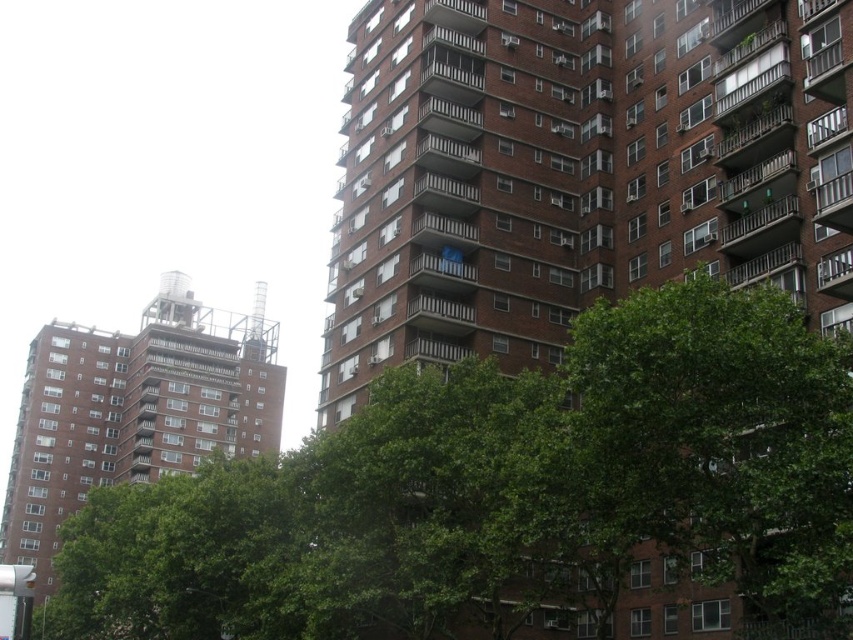
Does green leafy tree at lower left come behind green leafy tree at center?

Yes, green leafy tree at lower left is behind green leafy tree at center.

Is green leafy tree at lower left closer to camera compared to green leafy tree at center?

No.

Is point (778, 547) less distant than point (590, 394)?

Yes, point (778, 547) is closer to viewer.

Locate an element on the screen. This screenshot has height=640, width=853. green leafy tree at lower left is located at coordinates (508, 492).

From the picture: Which of these two, green leafy tree at center or brown brick building at left, stands taller?

brown brick building at left is taller.

Find the location of a particular element. This screenshot has width=853, height=640. green leafy tree at center is located at coordinates (720, 440).

Can you confirm if green leafy tree at lower left is bigger than brown brick building at left?

No.

In the scene shown: Is green leafy tree at lower left taller than brown brick building at left?

No, green leafy tree at lower left is not taller than brown brick building at left.

Which is in front, point (497, 595) or point (126, 413)?

Positioned in front is point (497, 595).

Identify the location of green leafy tree at lower left. This screenshot has height=640, width=853. [x=508, y=492].